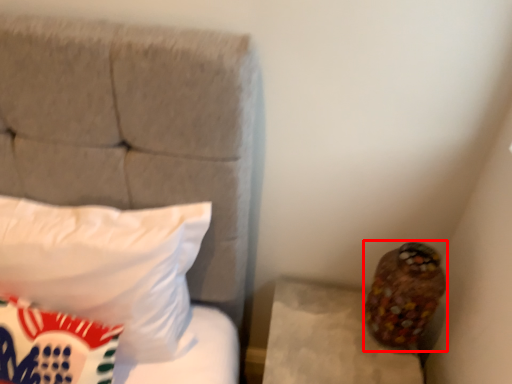
Question: Considering the relative positions of stuff (annotated by the red box) and pillow in the image provided, where is stuff (annotated by the red box) located with respect to the staircase?

Choices:
 (A) right
 (B) left

Answer: (A)